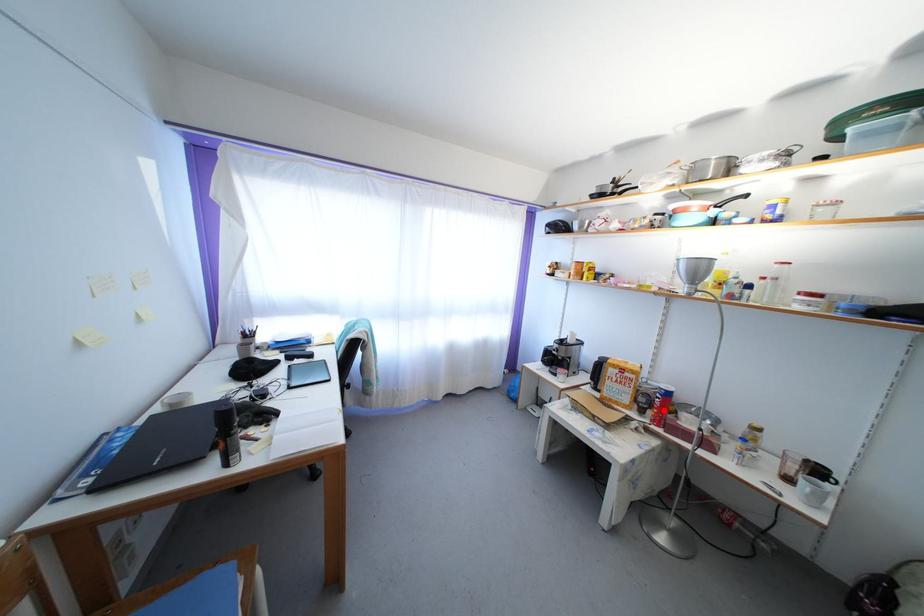
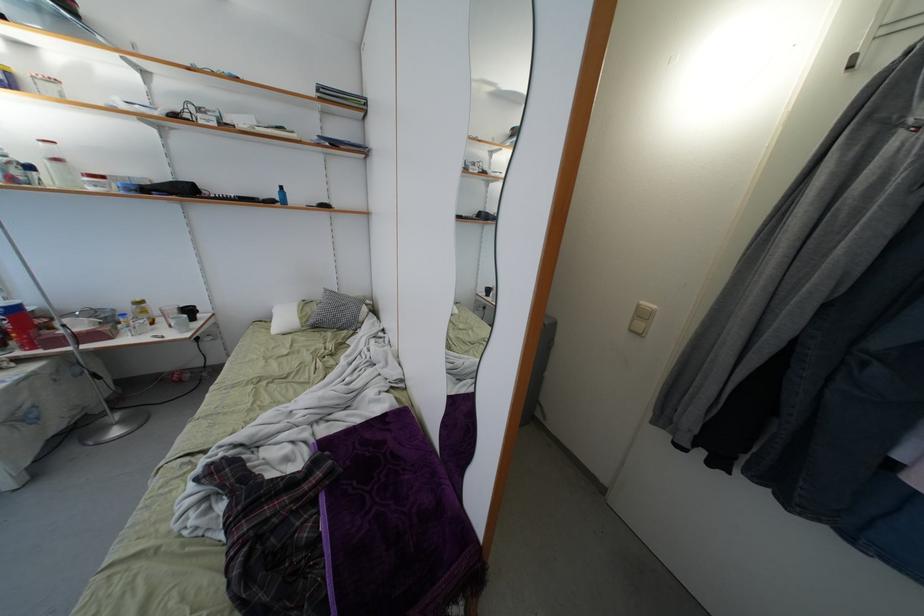
Question: I am providing you with two images of the same scene from different viewpoints. Given a red point in image1, look at the same physical point in image2. Is it:

Choices:
 (A) Closer to the viewpoint
 (B) Farther from the viewpoint

Answer: (B)